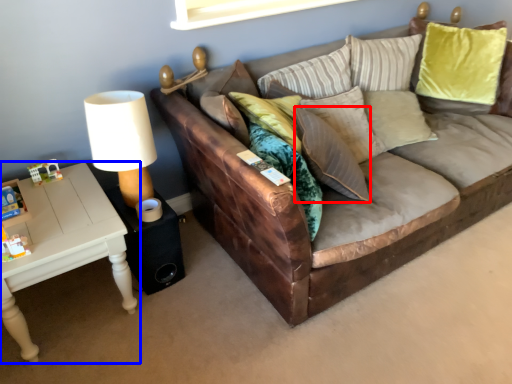
Question: Which of the following is the closest to the observer, pillow (highlighted by a red box) or table (highlighted by a blue box)?

Choices:
 (A) pillow
 (B) table

Answer: (B)